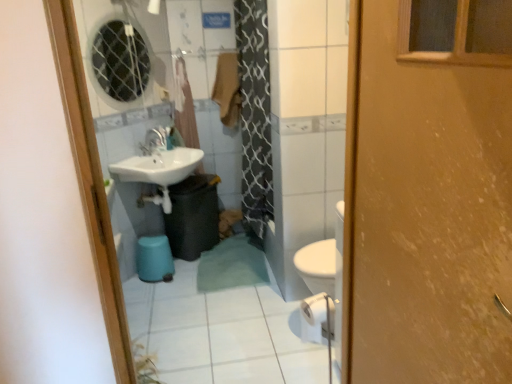
Question: Does translucent plastic curtain at upper center contain matte white faucet at center?

Choices:
 (A) no
 (B) yes

Answer: (A)

Question: From the image's perspective, is translucent plastic curtain at upper center located above matte white faucet at center?

Choices:
 (A) yes
 (B) no

Answer: (A)

Question: Can you confirm if translucent plastic curtain at upper center is shorter than matte white faucet at center?

Choices:
 (A) no
 (B) yes

Answer: (A)

Question: Is translucent plastic curtain at upper center further to the viewer compared to matte white faucet at center?

Choices:
 (A) no
 (B) yes

Answer: (B)

Question: Is translucent plastic curtain at upper center taller than matte white faucet at center?

Choices:
 (A) yes
 (B) no

Answer: (A)

Question: Is translucent plastic curtain at upper center turned away from matte white faucet at center?

Choices:
 (A) no
 (B) yes

Answer: (A)

Question: Is translucent plastic curtain at upper center looking in the opposite direction of black plastic trash can at lower center?

Choices:
 (A) no
 (B) yes

Answer: (A)

Question: Does translucent plastic curtain at upper center appear on the left side of black plastic trash can at lower center?

Choices:
 (A) yes
 (B) no

Answer: (A)

Question: Can we say translucent plastic curtain at upper center lies outside black plastic trash can at lower center?

Choices:
 (A) no
 (B) yes

Answer: (B)

Question: Would you say translucent plastic curtain at upper center is a long distance from black plastic trash can at lower center?

Choices:
 (A) no
 (B) yes

Answer: (A)

Question: Can you confirm if translucent plastic curtain at upper center is positioned to the right of black plastic trash can at lower center?

Choices:
 (A) yes
 (B) no

Answer: (B)

Question: From the image's perspective, would you say translucent plastic curtain at upper center is shown under black plastic trash can at lower center?

Choices:
 (A) no
 (B) yes

Answer: (A)

Question: Could you tell me if wooden door at right is turned towards translucent plastic curtain at upper center?

Choices:
 (A) no
 (B) yes

Answer: (A)